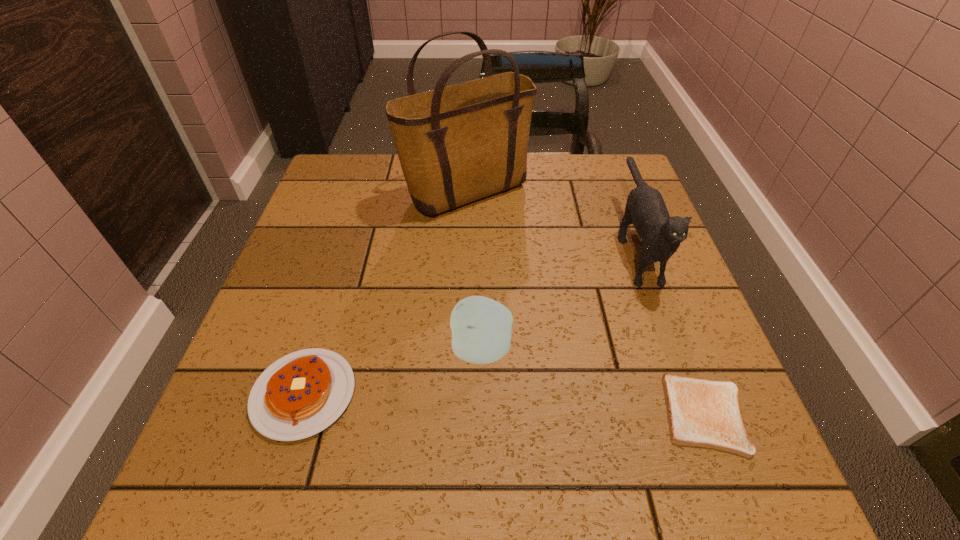
Identify the location of vacant space at the near edge of the desktop. (573, 496).

I want to click on vacant space at the left edge of the desktop, so click(315, 276).

Where is `vacant space at the right edge of the desktop`? The width and height of the screenshot is (960, 540). vacant space at the right edge of the desktop is located at coordinates click(x=662, y=307).

The height and width of the screenshot is (540, 960). I want to click on vacant region at the far left corner, so click(328, 165).

Where is `vacant space at the near left corner of the desktop`? vacant space at the near left corner of the desktop is located at coordinates (240, 498).

In the image, there is a desktop. Identify the location of vacant space at the far right corner. The height and width of the screenshot is (540, 960). (587, 154).

The image size is (960, 540). Identify the location of vacant space at the near right corner of the desktop. pos(750,491).

Where is `free area in between the shortest object and the tote bag`? free area in between the shortest object and the tote bag is located at coordinates (586, 305).

Image resolution: width=960 pixels, height=540 pixels. I want to click on vacant space in between the fourth tallest object and the apple, so click(x=393, y=372).

Where is `free space between the tallest object and the cat`? free space between the tallest object and the cat is located at coordinates (551, 219).